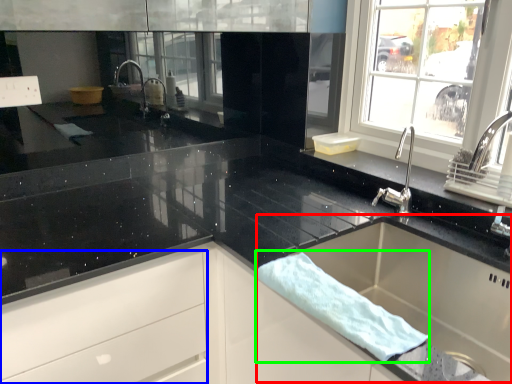
Question: Considering the real-world distances, which object is closest to sink (highlighted by a red box)? drawer (highlighted by a blue box) or bath towel (highlighted by a green box).

Choices:
 (A) drawer
 (B) bath towel

Answer: (B)